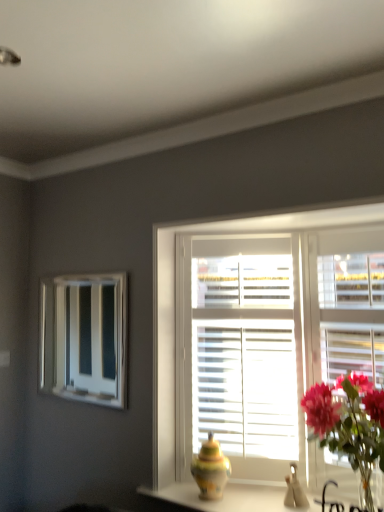
Question: Should I look upward or downward to see matte ceramic vase at center?

Choices:
 (A) down
 (B) up

Answer: (A)

Question: Does white wooden window at center appear on the left side of matte ceramic vase at center?

Choices:
 (A) no
 (B) yes

Answer: (A)

Question: Does white wooden window at center lie behind matte ceramic vase at center?

Choices:
 (A) no
 (B) yes

Answer: (B)

Question: From a real-world perspective, is white wooden window at center located higher than matte ceramic vase at center?

Choices:
 (A) no
 (B) yes

Answer: (B)

Question: Does white wooden window at center have a lesser width compared to matte ceramic vase at center?

Choices:
 (A) no
 (B) yes

Answer: (B)

Question: Is white wooden window at center not within matte ceramic vase at center?

Choices:
 (A) yes
 (B) no

Answer: (A)

Question: From the image's perspective, is white wooden window at center below matte ceramic vase at center?

Choices:
 (A) no
 (B) yes

Answer: (A)

Question: Is matte ceramic vase at center located outside white glossy mirror at upper left?

Choices:
 (A) yes
 (B) no

Answer: (A)

Question: Is white glossy mirror at upper left located within matte ceramic vase at center?

Choices:
 (A) yes
 (B) no

Answer: (B)

Question: Could you tell me if matte ceramic vase at center is facing white glossy mirror at upper left?

Choices:
 (A) yes
 (B) no

Answer: (B)

Question: From the image's perspective, is matte ceramic vase at center on top of white glossy mirror at upper left?

Choices:
 (A) no
 (B) yes

Answer: (A)

Question: Is matte ceramic vase at center thinner than white glossy mirror at upper left?

Choices:
 (A) no
 (B) yes

Answer: (A)

Question: Does matte ceramic vase at center have a smaller size compared to white glossy mirror at upper left?

Choices:
 (A) yes
 (B) no

Answer: (A)

Question: Is multicolored ceramic vase at center aimed at white glossy mirror at upper left?

Choices:
 (A) no
 (B) yes

Answer: (A)